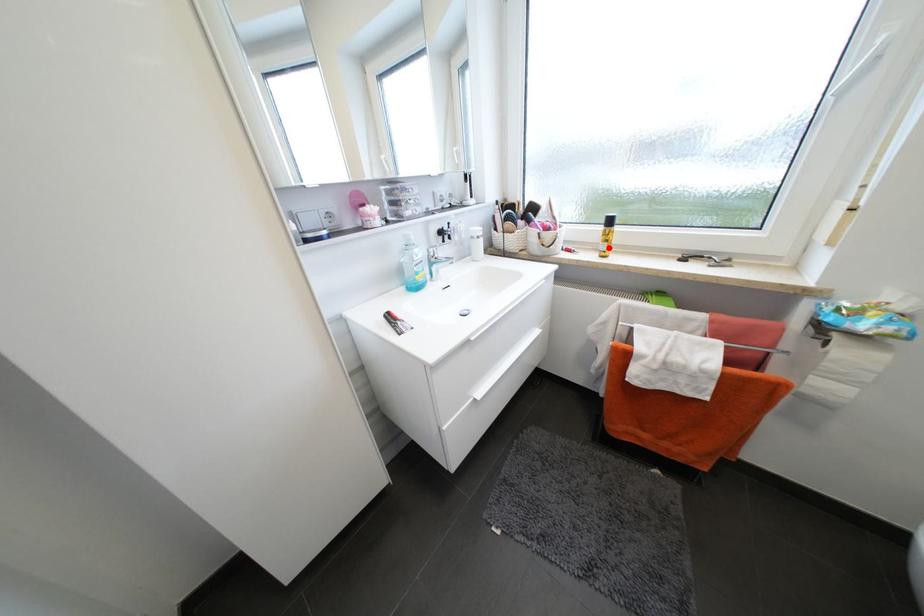
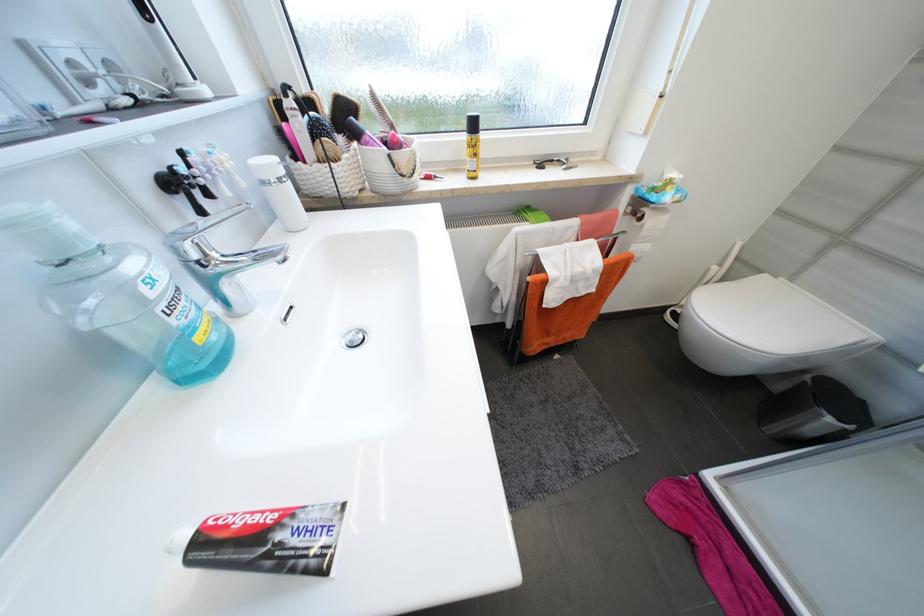
The point at the highlighted location is marked in the first image. Where is the corresponding point in the second image?

(477, 166)